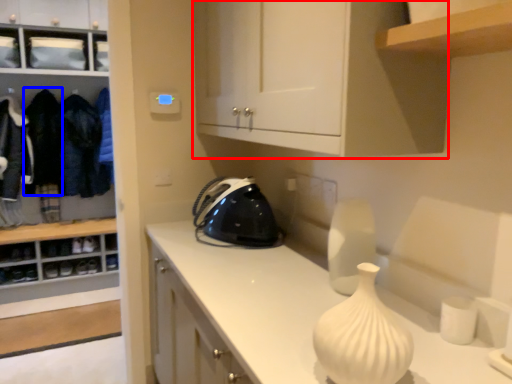
Question: Which object appears farthest to the camera in this image, cabinetry (highlighted by a red box) or clothing (highlighted by a blue box)?

Choices:
 (A) cabinetry
 (B) clothing

Answer: (B)